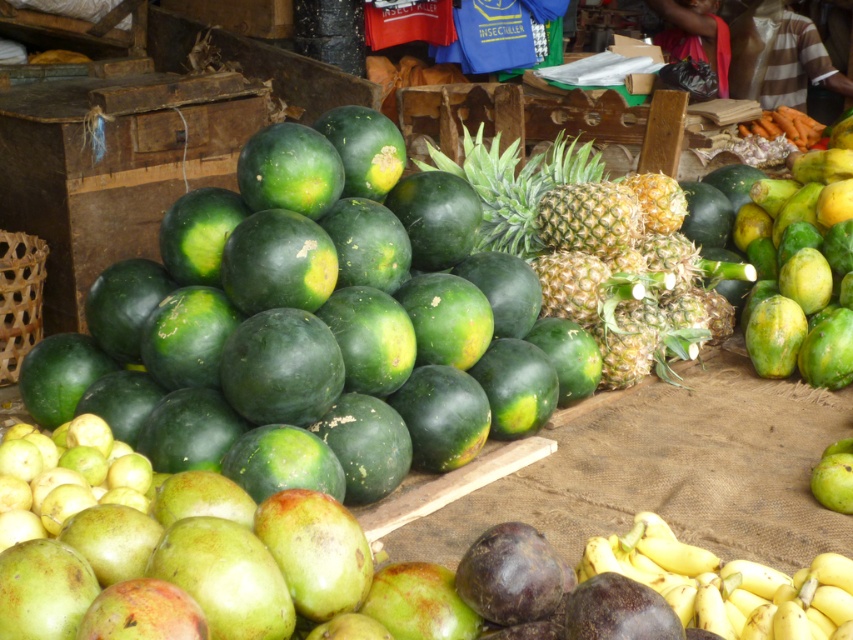
You are a customer at the fruit market and want to buy a fruit that can fit into a small basket. Which fruit between the green matte melon at center and the yellow matte bananas at lower right is more likely to fit?

The yellow matte bananas at lower right are more likely to fit into a small basket because they are narrower than the green matte melon at center, which might be wider.

You are a customer at the fruit market and want to find the green matte melon at center. Based on the scene description, where would you look relative to the pineapples?

The green matte melon at center is located to the left of the pineapples since it is at point (318, 330), which is to the left of the pineapples positioned further to the right.